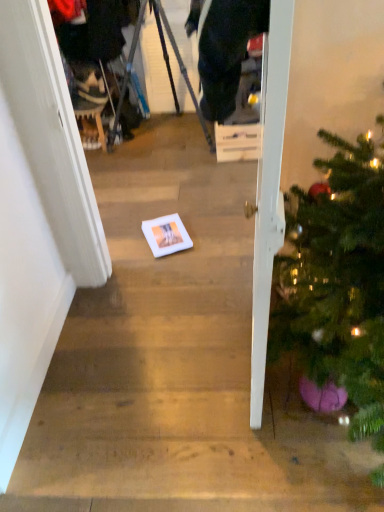
Where is `vacant space in front of white cardboard box at center`? The height and width of the screenshot is (512, 384). vacant space in front of white cardboard box at center is located at coordinates (217, 168).